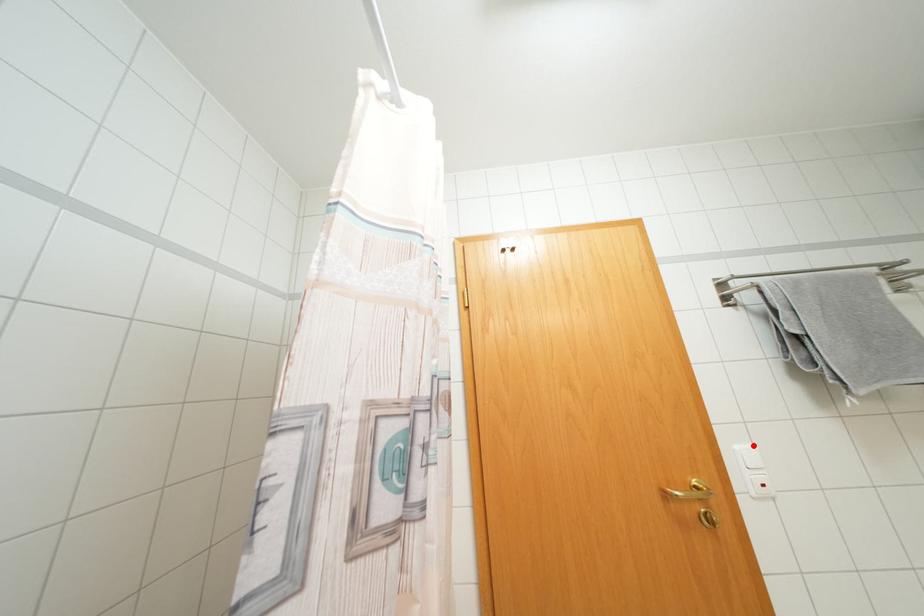
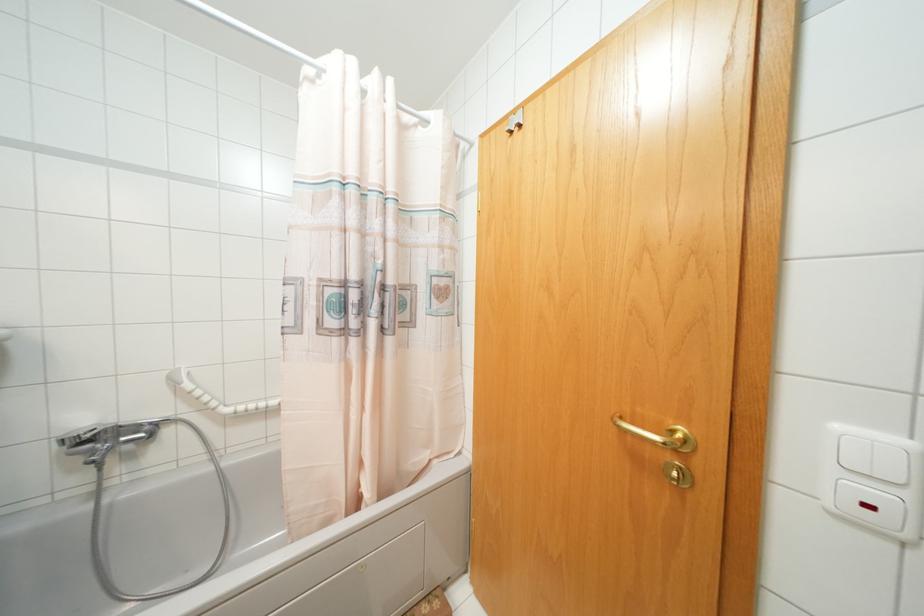
Locate, in the second image, the point that corresponds to the highlighted location in the first image.

(906, 442)